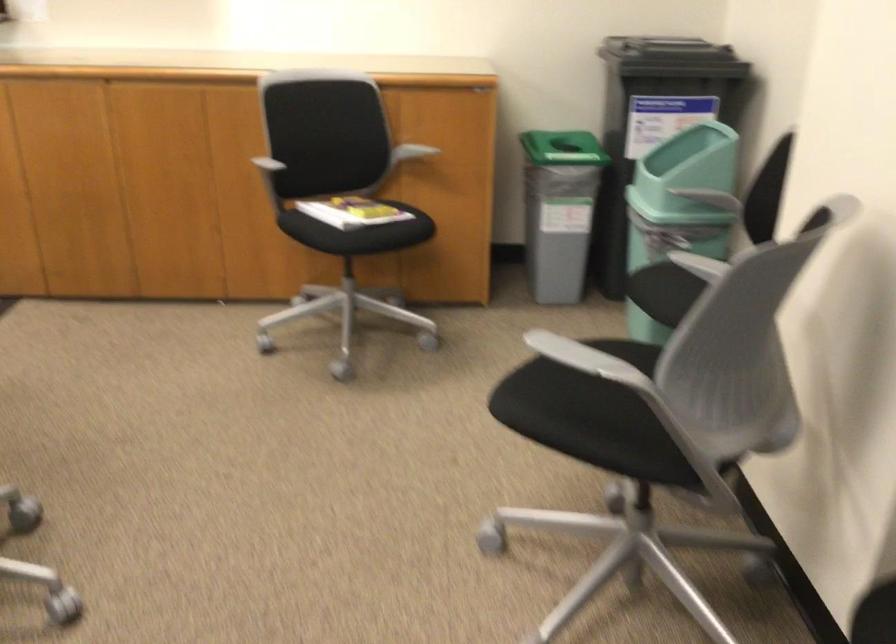
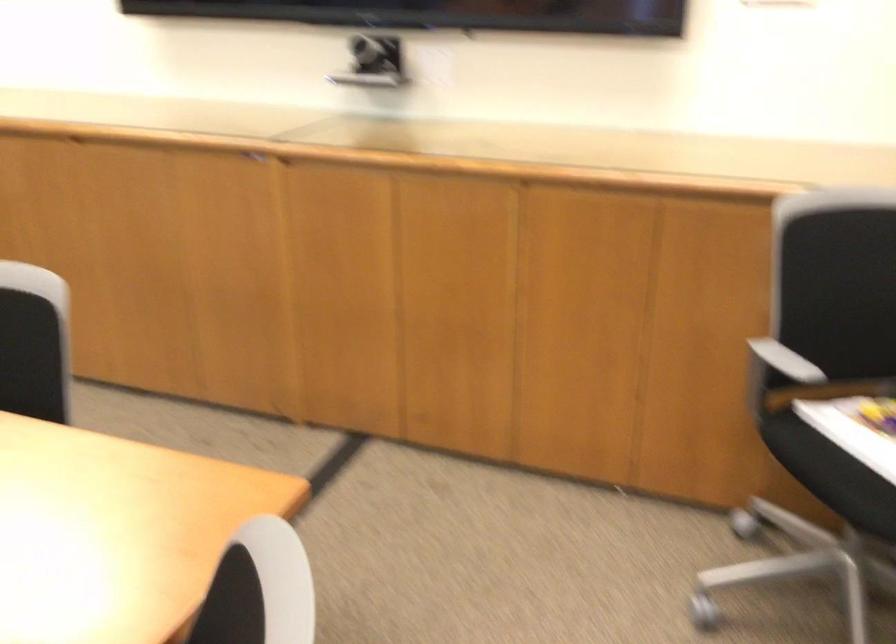
Where in the second image is the point corresponding to (x=325, y=212) from the first image?

(857, 442)